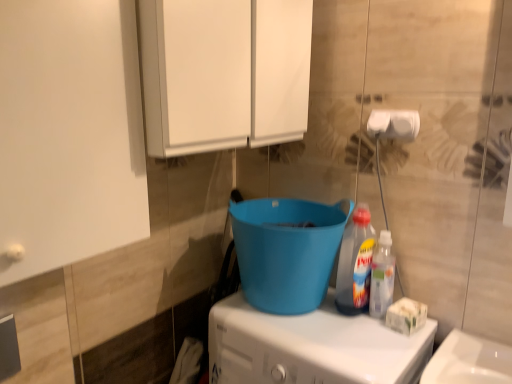
Locate an element on the screen. free location in front of translucent plastic bottle at right, which is the first bottle from right to left is located at coordinates (381, 348).